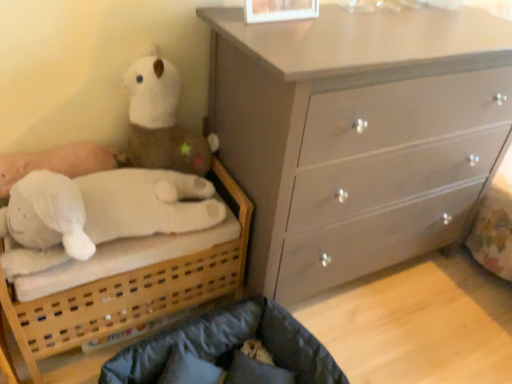
Question: Choose the correct answer: Is white soft bed at left inside velvety dark blue pillow at lower center or outside it?

Choices:
 (A) outside
 (B) inside

Answer: (A)

Question: From the image's perspective, relative to velvety dark blue pillow at lower center, is white soft bed at left above or below?

Choices:
 (A) below
 (B) above

Answer: (B)

Question: Which of these objects is positioned closest to the velvety dark blue pillow at lower center?

Choices:
 (A) white plush toy at upper left
 (B) light gray wooden chest of drawers at upper right
 (C) white plush toy at left
 (D) dark gray fabric infant bed at lower center
 (E) white soft bed at left

Answer: (D)

Question: Estimate the real-world distances between objects in this image. Which object is closer to the white soft bed at left?

Choices:
 (A) white plush toy at upper left
 (B) light gray wooden chest of drawers at upper right
 (C) velvety dark blue pillow at lower center
 (D) white plush toy at left
 (E) dark gray fabric infant bed at lower center

Answer: (D)